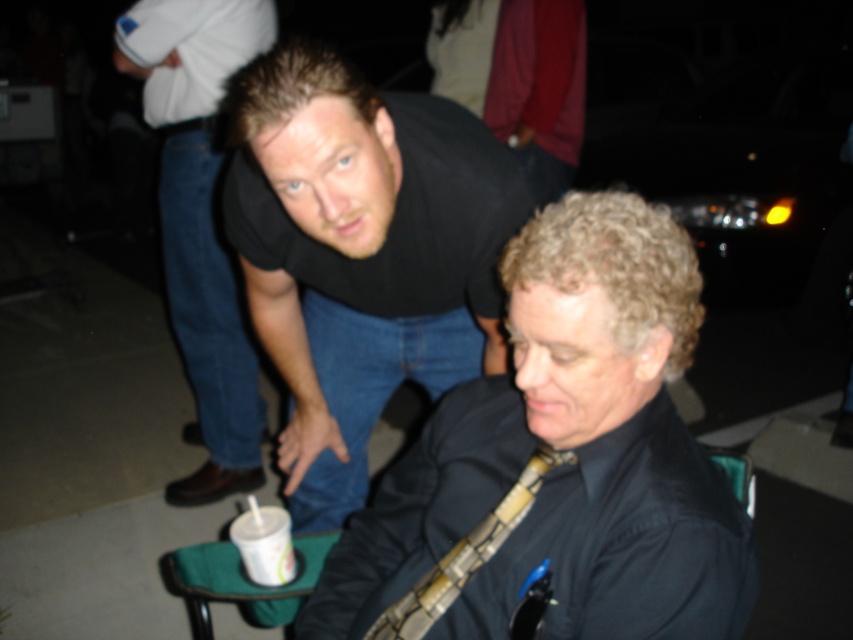
Does black matte shirt at upper center come in front of white paper cup at lower left?

Yes, it is in front of white paper cup at lower left.

Does black matte shirt at upper center appear on the left side of white paper cup at lower left?

No, black matte shirt at upper center is not to the left of white paper cup at lower left.

Find the location of a particular element. Image resolution: width=853 pixels, height=640 pixels. black matte shirt at upper center is located at coordinates pos(361,253).

Locate an element on the screen. Image resolution: width=853 pixels, height=640 pixels. black matte shirt at upper center is located at coordinates (361, 253).

Which is in front, point (194, 384) or point (271, 536)?

Point (271, 536) is in front.

Can you confirm if black cotton shirt at upper center is positioned to the left of white paper cup at lower left?

Yes, black cotton shirt at upper center is to the left of white paper cup at lower left.

Image resolution: width=853 pixels, height=640 pixels. I want to click on black cotton shirt at upper center, so click(200, 218).

Based on the photo, who is lower down, matte black shirt at upper center or black cotton shirt at upper center?

→ Positioned lower is matte black shirt at upper center.

Consider the image. Can you confirm if matte black shirt at upper center is bigger than black cotton shirt at upper center?

No.

Who is more distant from viewer, (675, 266) or (161, 60)?

The point (161, 60) is behind.

The image size is (853, 640). I want to click on matte black shirt at upper center, so click(561, 460).